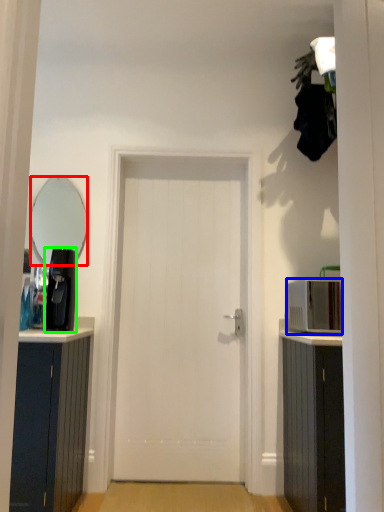
Question: Estimate the real-world distances between objects in this image. Which object is farther from mirror (highlighted by a red box), appliance (highlighted by a blue box) or coffee machine (highlighted by a green box)?

Choices:
 (A) appliance
 (B) coffee machine

Answer: (A)